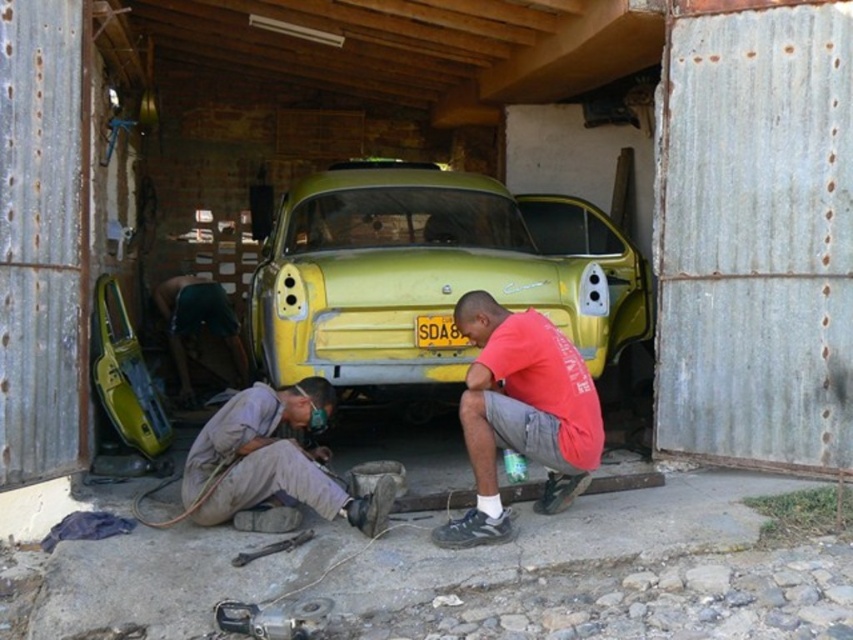
You are a mechanic working in the garage. You need to locate the red cotton shirt at center. Where exactly is it positioned in the garage?

The red cotton shirt at center is positioned at point 0.647 on the x axis and 0.612 on the y axis.

You are an auto mechanic working in this garage. You need to move the red cotton shirt at center to access the engine of the yellow matte car at center. Can you move the shirt without moving the car?

The yellow matte car at center is bigger than the red cotton shirt at center, so yes, you can move the red cotton shirt at center out of the way without needing to move the car.

You are a mechanic working in this garage. You need to lift the yellow matte car at center using a hydraulic jack. The jack can only support objects up to the height of the red cotton shirt at center. Will the jack be sufficient for this task?

The yellow matte car at center has a greater height compared to the red cotton shirt at center. Therefore, the hydraulic jack, which can only support objects up to the height of the red cotton shirt at center, will not be sufficient to lift the yellow matte car at center.